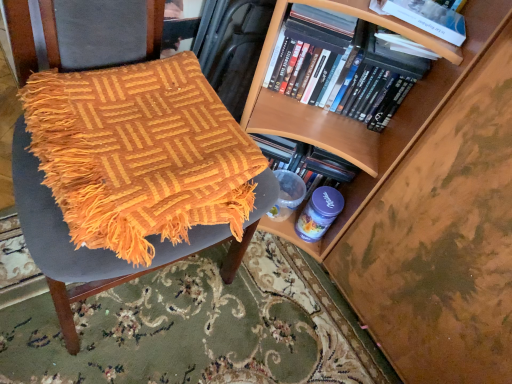
Question: Is orange woven blanket at left smaller than hardcover book at upper right, which appears as the 1th book when viewed from the front?

Choices:
 (A) yes
 (B) no

Answer: (B)

Question: Is orange woven blanket at left bigger than hardcover book at upper right, which appears as the 1th book when viewed from the front?

Choices:
 (A) yes
 (B) no

Answer: (A)

Question: Is orange woven blanket at left positioned before hardcover book at upper right, which appears as the 1th book when viewed from the front?

Choices:
 (A) no
 (B) yes

Answer: (B)

Question: Is orange woven blanket at left positioned with its back to hardcover book at upper right, which is the 2th book from back to front?

Choices:
 (A) yes
 (B) no

Answer: (B)

Question: Is orange woven blanket at left to the right of hardcover book at upper right, which appears as the 1th book when viewed from the front, from the viewer's perspective?

Choices:
 (A) yes
 (B) no

Answer: (B)

Question: From the image's perspective, would you say orange woven blanket at left is shown under hardcover book at upper right, which appears as the 1th book when viewed from the front?

Choices:
 (A) yes
 (B) no

Answer: (A)

Question: Considering the relative sizes of hardcover book at upper right and black matte dvds at upper right, the first book positioned from the back, in the image provided, is hardcover book at upper right shorter than black matte dvds at upper right, the first book positioned from the back,?

Choices:
 (A) yes
 (B) no

Answer: (A)

Question: Is hardcover book at upper right positioned with its back to black matte dvds at upper right, arranged as the second book when viewed from the front?

Choices:
 (A) no
 (B) yes

Answer: (A)

Question: Considering the relative positions of hardcover book at upper right and black matte dvds at upper right, the first book positioned from the back, in the image provided, is hardcover book at upper right to the right of black matte dvds at upper right, the first book positioned from the back, from the viewer's perspective?

Choices:
 (A) yes
 (B) no

Answer: (B)

Question: Is hardcover book at upper right located outside black matte dvds at upper right, the first book positioned from the back?

Choices:
 (A) no
 (B) yes

Answer: (B)

Question: Can you confirm if hardcover book at upper right is taller than black matte dvds at upper right, arranged as the second book when viewed from the front?

Choices:
 (A) yes
 (B) no

Answer: (B)

Question: From a real-world perspective, is hardcover book at upper right under black matte dvds at upper right, arranged as the second book when viewed from the front?

Choices:
 (A) yes
 (B) no

Answer: (B)

Question: From a real-world perspective, is black matte dvds at upper right, arranged as the second book when viewed from the front, located beneath hardcover book at upper right, which appears as the 1th book when viewed from the front?

Choices:
 (A) no
 (B) yes

Answer: (B)